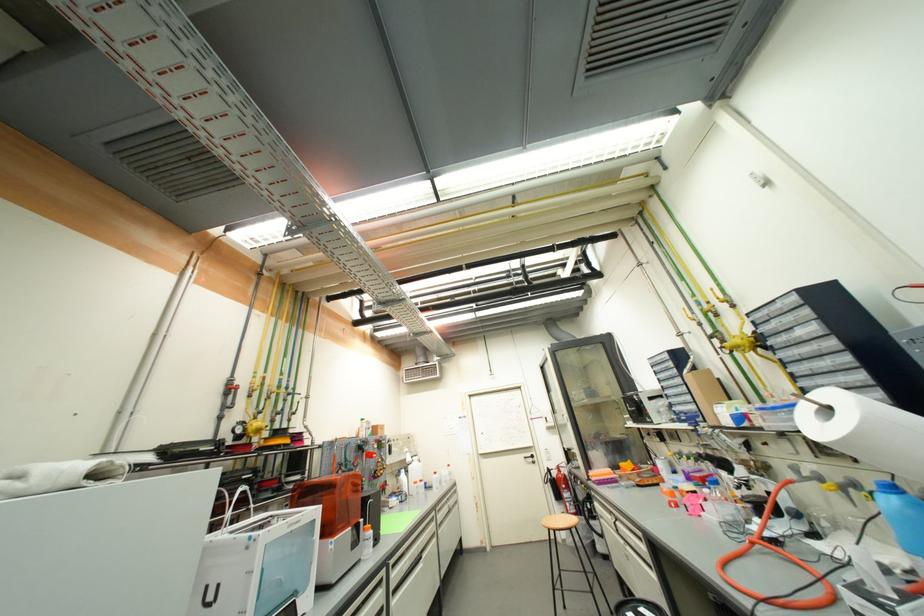
Find where to turn the red valve handle. Please return your answer as a coordinate pair (x, y).

(775, 564)